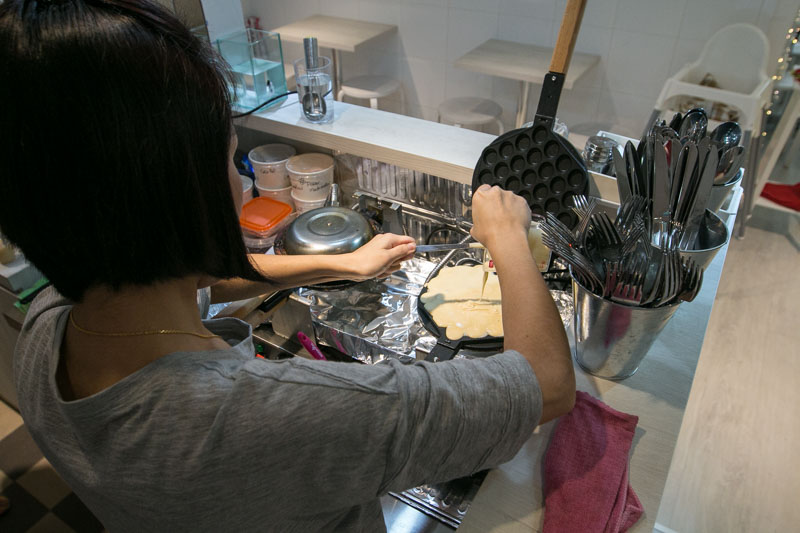
Identify the location of wash cloth. The width and height of the screenshot is (800, 533). (584, 492).